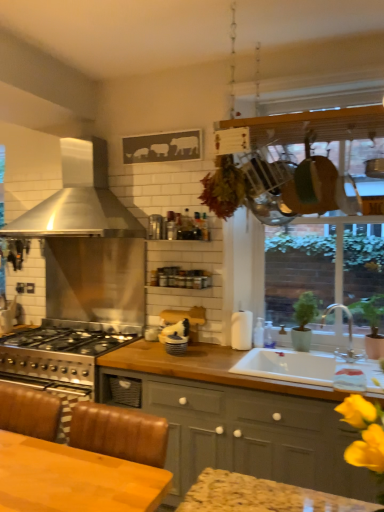
Question: Is wooden table at lower left thinner than white glossy jar at center, marked as the 1th appliance in a bottom-to-top arrangement?

Choices:
 (A) yes
 (B) no

Answer: (B)

Question: Is the position of wooden table at lower left more distant than that of white glossy jar at center, the 2th appliance in the right-to-left sequence?

Choices:
 (A) yes
 (B) no

Answer: (B)

Question: Is wooden table at lower left closer to camera compared to white glossy jar at center, which is the 3th appliance in top-to-bottom order?

Choices:
 (A) yes
 (B) no

Answer: (A)

Question: Would you say wooden table at lower left is outside white glossy jar at center, the 2th appliance in the right-to-left sequence?

Choices:
 (A) yes
 (B) no

Answer: (A)

Question: Is wooden table at lower left shorter than white glossy jar at center, which is the 3th appliance in top-to-bottom order?

Choices:
 (A) no
 (B) yes

Answer: (A)

Question: Is white glossy jar at center, which is the 3th appliance in top-to-bottom order, a part of wooden table at lower left?

Choices:
 (A) no
 (B) yes

Answer: (A)

Question: Does wooden table at lower left have a lesser height compared to matte gray cabinets at center?

Choices:
 (A) yes
 (B) no

Answer: (A)

Question: From the image's perspective, is wooden table at lower left beneath matte gray cabinets at center?

Choices:
 (A) no
 (B) yes

Answer: (A)

Question: Does wooden table at lower left have a greater width compared to matte gray cabinets at center?

Choices:
 (A) yes
 (B) no

Answer: (B)

Question: Is wooden table at lower left completely or partially outside of matte gray cabinets at center?

Choices:
 (A) no
 (B) yes

Answer: (B)

Question: Is wooden table at lower left thinner than matte gray cabinets at center?

Choices:
 (A) yes
 (B) no

Answer: (A)

Question: Is wooden table at lower left aimed at matte gray cabinets at center?

Choices:
 (A) yes
 (B) no

Answer: (B)

Question: Is white glossy jar at center, the third appliance in the back-to-front sequence, thinner than matte gray cabinets at center?

Choices:
 (A) no
 (B) yes

Answer: (B)